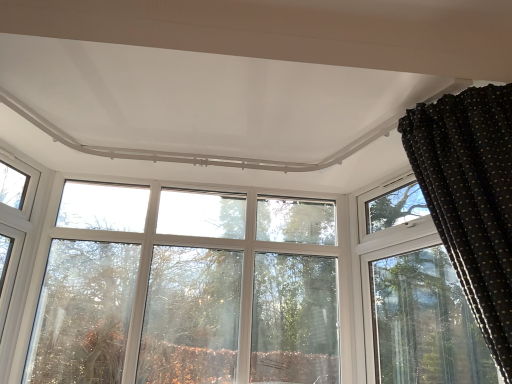
Describe the element at coordinates (471, 198) in the screenshot. I see `black dotted fabric at upper right` at that location.

Locate an element on the screen. clear glass window at upper left is located at coordinates (13, 222).

At what (x,y) coordinates should I click in order to perform the action: click on black dotted fabric at upper right. Please return your answer as a coordinate pair (x, y). Looking at the image, I should click on (471, 198).

How many degrees apart are the facing directions of black dotted fabric at upper right and transparent glass tree at center?

The angular difference between black dotted fabric at upper right and transparent glass tree at center is 92 degrees.

In order to click on tree on the left side of black dotted fabric at upper right in this screenshot , I will do `click(188, 288)`.

Relative to transparent glass tree at center, is black dotted fabric at upper right in front or behind?

Visually, black dotted fabric at upper right is located in front of transparent glass tree at center.

Looking at this image, from the image's perspective, is transparent glass tree at center above black dotted fabric at upper right?

No, from the image's perspective, transparent glass tree at center is not over black dotted fabric at upper right.

Looking at the image, does transparent glass tree at center seem bigger or smaller compared to black dotted fabric at upper right?

Considering their sizes, transparent glass tree at center takes up less space than black dotted fabric at upper right.

Is point (181, 288) farther from camera compared to point (507, 110)?

Yes, it is.

Is transparent glass tree at center oriented towards black dotted fabric at upper right?

Yes.

Can you confirm if clear glass window at upper left is positioned to the right of black dotted fabric at upper right?

Incorrect, clear glass window at upper left is not on the right side of black dotted fabric at upper right.

Does clear glass window at upper left have a smaller size compared to black dotted fabric at upper right?

Yes, clear glass window at upper left is smaller than black dotted fabric at upper right.

From the image's perspective, would you say clear glass window at upper left is shown under black dotted fabric at upper right?

Yes, from the image's perspective, clear glass window at upper left is below black dotted fabric at upper right.

Between transparent glass tree at center and clear glass window at upper left, which one has smaller size?

clear glass window at upper left.

Consider the image. How distant is transparent glass tree at center from clear glass window at upper left?

The distance of transparent glass tree at center from clear glass window at upper left is 30.56 inches.

Based on the photo, can you confirm if transparent glass tree at center is thinner than clear glass window at upper left?

Yes.

From the picture: Is transparent glass tree at center in front of clear glass window at upper left?

No, it is not.

Considering the positions of objects clear glass window at upper left and transparent glass tree at center in the image provided, who is behind, clear glass window at upper left or transparent glass tree at center?

Positioned behind is transparent glass tree at center.

At what (x,y) coordinates should I click in order to perform the action: click on tree above the clear glass window at upper left (from a real-world perspective). Please return your answer as a coordinate pair (x, y). Looking at the image, I should click on (188, 288).

From a real-world perspective, is clear glass window at upper left on top of transparent glass tree at center?

No, from a real-world perspective, clear glass window at upper left is not on top of transparent glass tree at center.

From the picture: Which object is further away from the camera taking this photo, black dotted fabric at upper right or clear glass window at upper left?

clear glass window at upper left is more distant.

What are the coordinates of `curtain on the right of clear glass window at upper left` in the screenshot? It's located at (471, 198).

Does point (488, 150) come farther from viewer compared to point (5, 258)?

No.

Is clear glass window at upper left at the back of black dotted fabric at upper right?

No.

I want to click on tree below the black dotted fabric at upper right (from a real-world perspective), so click(x=188, y=288).

Locate an element on the screen. This screenshot has height=384, width=512. curtain in front of the transparent glass tree at center is located at coordinates (471, 198).

Considering their positions, is black dotted fabric at upper right positioned closer to clear glass window at upper left than transparent glass tree at center?

transparent glass tree at center lies closer to clear glass window at upper left than the other object.

Consider the image. Which object lies further to the anchor point black dotted fabric at upper right, transparent glass tree at center or clear glass window at upper left?

The object further to black dotted fabric at upper right is clear glass window at upper left.

Estimate the real-world distances between objects in this image. Which object is further from clear glass window at upper left, transparent glass tree at center or black dotted fabric at upper right?

Among the two, black dotted fabric at upper right is located further to clear glass window at upper left.

Considering their positions, is clear glass window at upper left positioned closer to black dotted fabric at upper right than transparent glass tree at center?

transparent glass tree at center lies closer to black dotted fabric at upper right than the other object.

Estimate the real-world distances between objects in this image. Which object is further from transparent glass tree at center, black dotted fabric at upper right or clear glass window at upper left?

black dotted fabric at upper right is positioned further to the anchor transparent glass tree at center.

Looking at the image, which one is located closer to transparent glass tree at center, clear glass window at upper left or black dotted fabric at upper right?

clear glass window at upper left is closer to transparent glass tree at center.

Where is `tree situated between clear glass window at upper left and black dotted fabric at upper right from left to right`? tree situated between clear glass window at upper left and black dotted fabric at upper right from left to right is located at coordinates (188, 288).